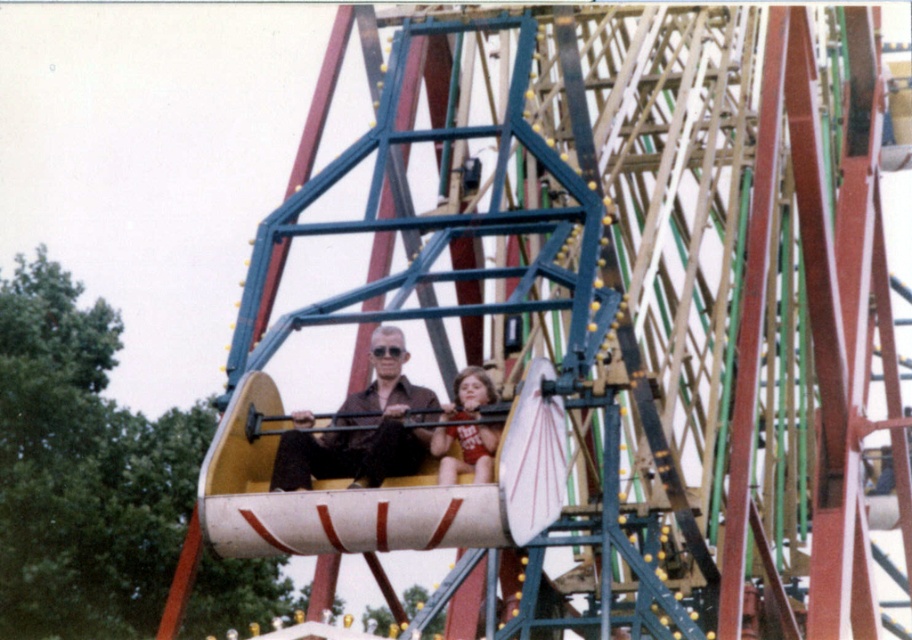
You are a photographer at the fairground. You need to capture a photo of the two people on the ride so that both the matte brown shirt at center and the matte red swimsuit at center are clearly visible. Given their heights, which person should be positioned closer to the front of the frame to ensure both are fully visible?

The matte red swimsuit at center should be positioned closer to the front of the frame because the matte brown shirt at center is much taller. This arrangement ensures that the shorter person isn not blocked by the taller one.

You are standing in the fairground and see the ride with two people seated in one of its swings. The adult is wearing a matte brown shirt at center and the child is wearing a matte red swimsuit at center. Which person is sitting closer to the left side of the swing?

The matte brown shirt at center is to the left of the matte red swimsuit at center, so the adult wearing the matte brown shirt at center is sitting closer to the left side of the swing.